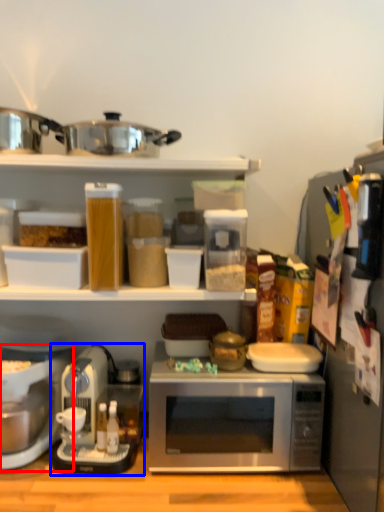
Question: Which of the following is the closest to the observer, coffee maker (highlighted by a red box) or coffee maker (highlighted by a blue box)?

Choices:
 (A) coffee maker
 (B) coffee maker

Answer: (A)